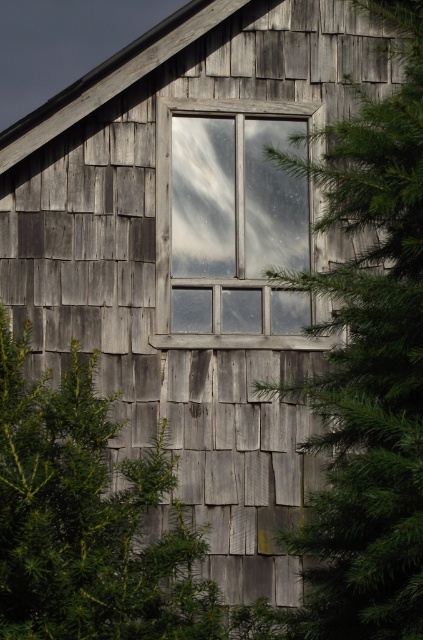
You are standing in front of the rustic wooden building and see the green textured pine tree at center and the transparent glass window at center. Which object is located to the right of the other?

The green textured pine tree at center is positioned on the right side of transparent glass window at center.

Based on the photo, you are a painter standing in front of the rustic wooden building. You want to paint the green textured pine tree at center and the transparent glass window at center. Which object requires more paint to cover its surface?

The transparent glass window at center requires more paint to cover its surface because it is wider than the green textured pine tree at center.

What is located at the point with coordinates (368, 365) in the image?

The green textured pine tree at center is located at point (368, 365).